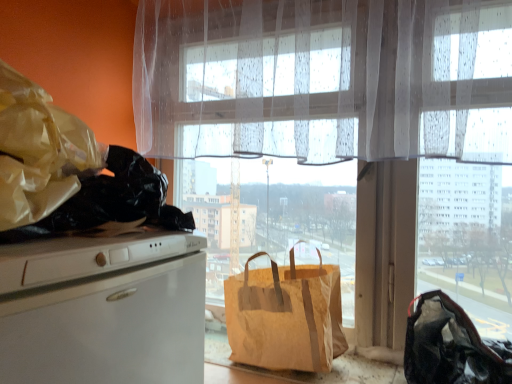
Question: Considering the relative sizes of translucent white curtain at upper center and black fabric bag at lower right, acting as the 1th handbag starting from the right, in the image provided, is translucent white curtain at upper center wider than black fabric bag at lower right, acting as the 1th handbag starting from the right,?

Choices:
 (A) yes
 (B) no

Answer: (B)

Question: Is translucent white curtain at upper center to the left of black fabric bag at lower right, acting as the 2th handbag starting from the left, from the viewer's perspective?

Choices:
 (A) no
 (B) yes

Answer: (B)

Question: From the image's perspective, would you say translucent white curtain at upper center is shown under black fabric bag at lower right, acting as the 2th handbag starting from the left?

Choices:
 (A) yes
 (B) no

Answer: (B)

Question: Is translucent white curtain at upper center facing away from black fabric bag at lower right, acting as the 2th handbag starting from the left?

Choices:
 (A) yes
 (B) no

Answer: (B)

Question: From the image's perspective, is translucent white curtain at upper center over black fabric bag at lower right, acting as the 2th handbag starting from the left?

Choices:
 (A) no
 (B) yes

Answer: (B)

Question: In terms of width, does brown paper bag at window, the second handbag viewed from the right, look wider or thinner when compared to translucent fabric window at center?

Choices:
 (A) wide
 (B) thin

Answer: (A)

Question: From the image's perspective, is brown paper bag at window, the second handbag viewed from the right, located above or below translucent fabric window at center?

Choices:
 (A) above
 (B) below

Answer: (B)

Question: From a real-world perspective, relative to translucent fabric window at center, is brown paper bag at window, the second handbag viewed from the right, vertically above or below?

Choices:
 (A) below
 (B) above

Answer: (A)

Question: Relative to translucent fabric window at center, is brown paper bag at window, the first handbag when ordered from left to right, in front or behind?

Choices:
 (A) behind
 (B) front

Answer: (B)

Question: Based on their positions, is translucent white curtain at upper center located to the left or right of translucent fabric window at center?

Choices:
 (A) right
 (B) left

Answer: (B)

Question: From the image's perspective, is translucent white curtain at upper center located above or below translucent fabric window at center?

Choices:
 (A) above
 (B) below

Answer: (A)

Question: Looking at the image, does translucent white curtain at upper center seem bigger or smaller compared to translucent fabric window at center?

Choices:
 (A) big
 (B) small

Answer: (A)

Question: From their relative heights in the image, would you say translucent white curtain at upper center is taller or shorter than translucent fabric window at center?

Choices:
 (A) tall
 (B) short

Answer: (B)

Question: In the image, is black fabric bag at lower right, acting as the 2th handbag starting from the left, on the left side or the right side of translucent fabric window at center?

Choices:
 (A) right
 (B) left

Answer: (A)

Question: From a real-world perspective, is black fabric bag at lower right, acting as the 1th handbag starting from the right, physically located above or below translucent fabric window at center?

Choices:
 (A) below
 (B) above

Answer: (A)